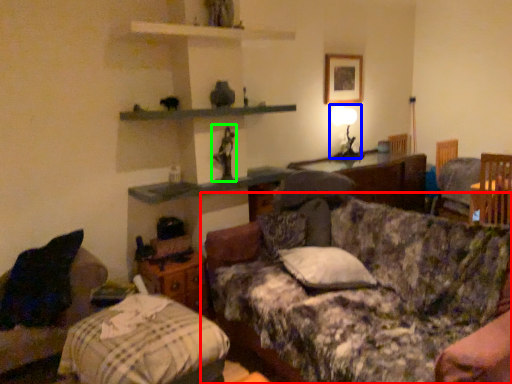
Question: Considering the real-world distances, which object is closest to studio couch (highlighted by a red box)? table lamp (highlighted by a blue box) or toy (highlighted by a green box).

Choices:
 (A) table lamp
 (B) toy

Answer: (B)